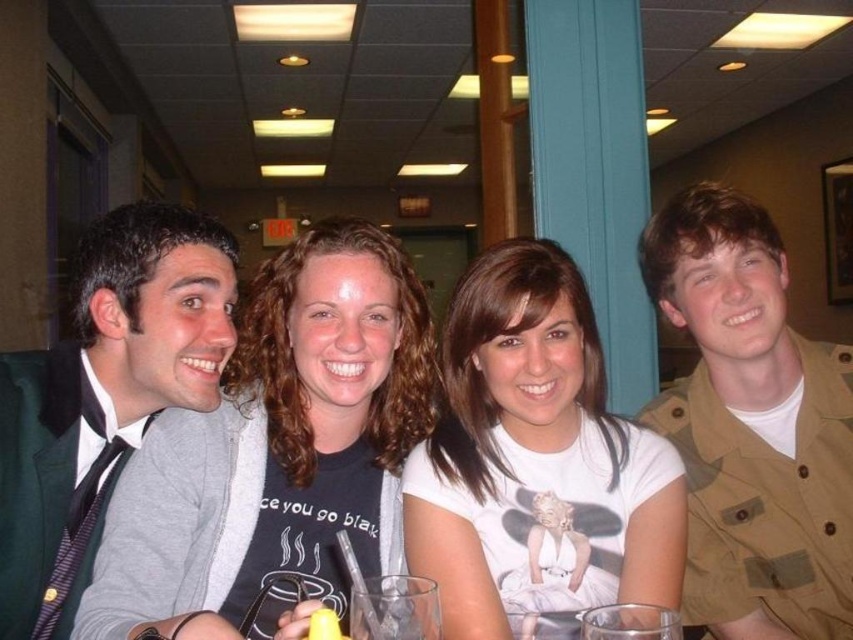
Is point (225, 419) more distant than point (606, 420)?

No, it is in front of (606, 420).

Does matte black t-shirt at center have a lesser height compared to white cotton t-shirt at center?

No.

Identify the location of matte black t-shirt at center. (277, 442).

Is the position of matte black t-shirt at center more distant than that of tan fabric shirt at right?

No, matte black t-shirt at center is in front of tan fabric shirt at right.

Does matte black t-shirt at center appear on the right side of tan fabric shirt at right?

No, matte black t-shirt at center is not to the right of tan fabric shirt at right.

Where is `matte black t-shirt at center`? The height and width of the screenshot is (640, 853). matte black t-shirt at center is located at coordinates (277, 442).

Who is taller, white cotton t-shirt at center or tan fabric shirt at right?

Standing taller between the two is tan fabric shirt at right.

Between point (498, 540) and point (773, 417), which one is positioned behind?

Positioned behind is point (773, 417).

Where is `white cotton t-shirt at center`? The height and width of the screenshot is (640, 853). white cotton t-shirt at center is located at coordinates (537, 458).

The width and height of the screenshot is (853, 640). I want to click on white cotton t-shirt at center, so click(x=537, y=458).